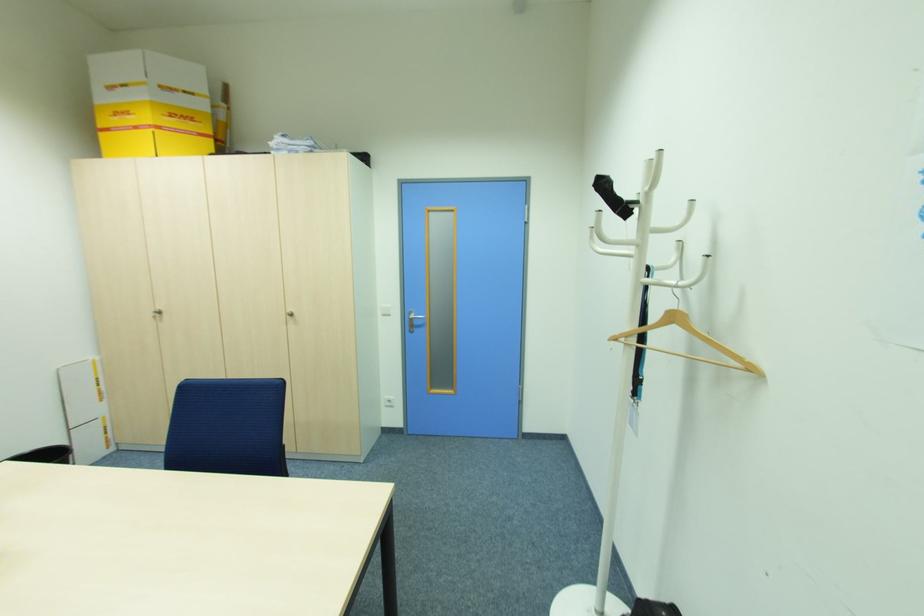
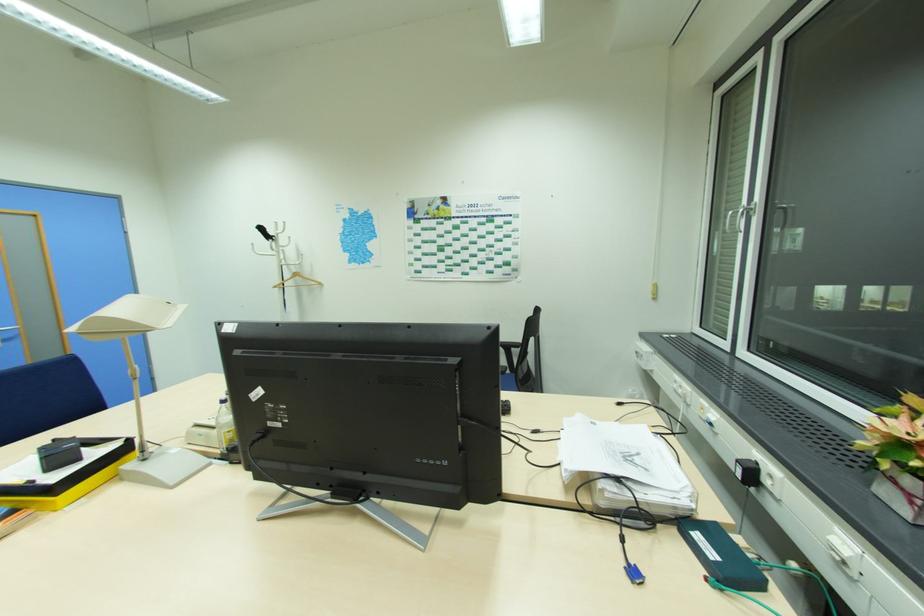
Find the pixel in the second image that matches (x=617, y=339) in the first image.

(277, 286)